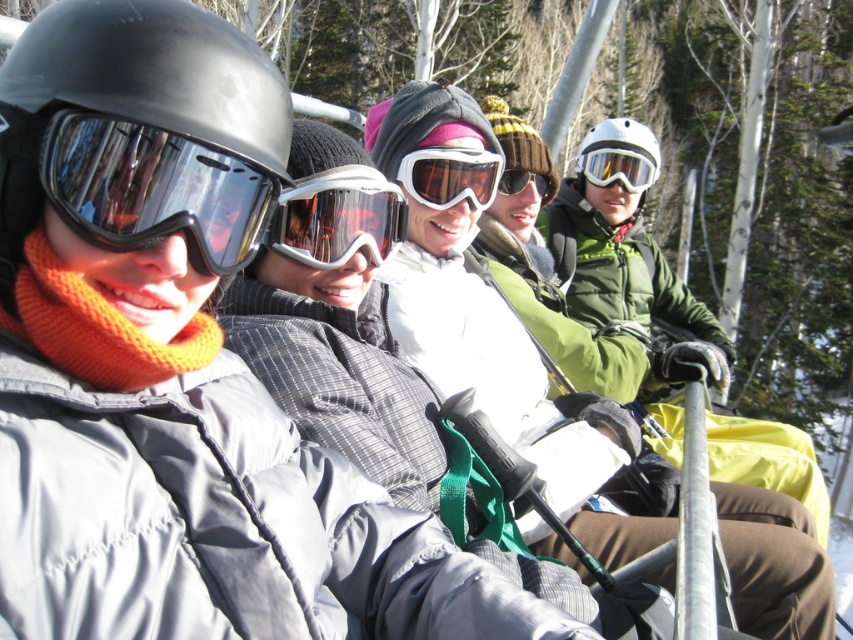
You are on a ski lift with several people. You notice two points marked in the scene. The first point is at coordinates point (x=321, y=180) and the second point is at point (x=407, y=173). Which of these two points is closer to you, the observer?

Point (x=321, y=180) is closer to the camera than point (x=407, y=173).

You are a ski instructor checking gear sizes for two students. The first student has a matte black helmet at left, and the second has transparent plastic goggles at center. Which gear item is smaller in size?

The matte black helmet at left has a smaller size compared to the transparent plastic goggles at center, so the matte black helmet at left is smaller.